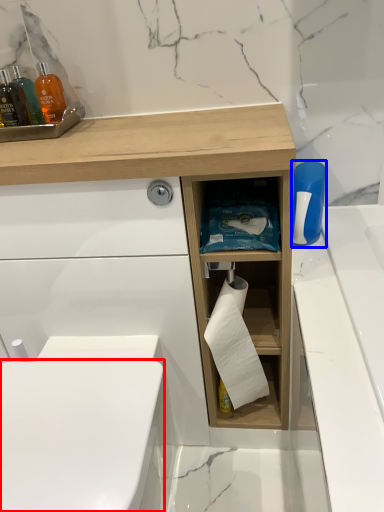
Question: Which object is closer to the camera taking this photo, toilet bowl (highlighted by a red box) or cleaning product (highlighted by a blue box)?

Choices:
 (A) toilet bowl
 (B) cleaning product

Answer: (A)